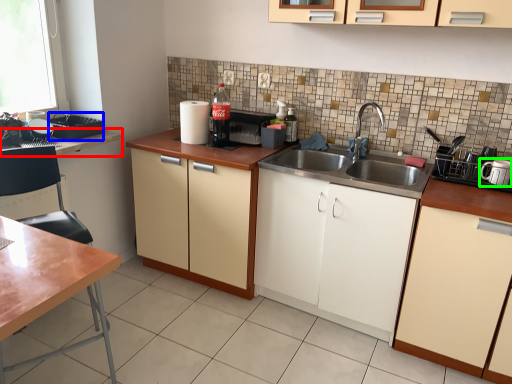
Question: Based on their relative distances, which object is farther from countertop (highlighted by a red box)? Choose from appliance (highlighted by a blue box) and appliance (highlighted by a green box).

Choices:
 (A) appliance
 (B) appliance

Answer: (B)